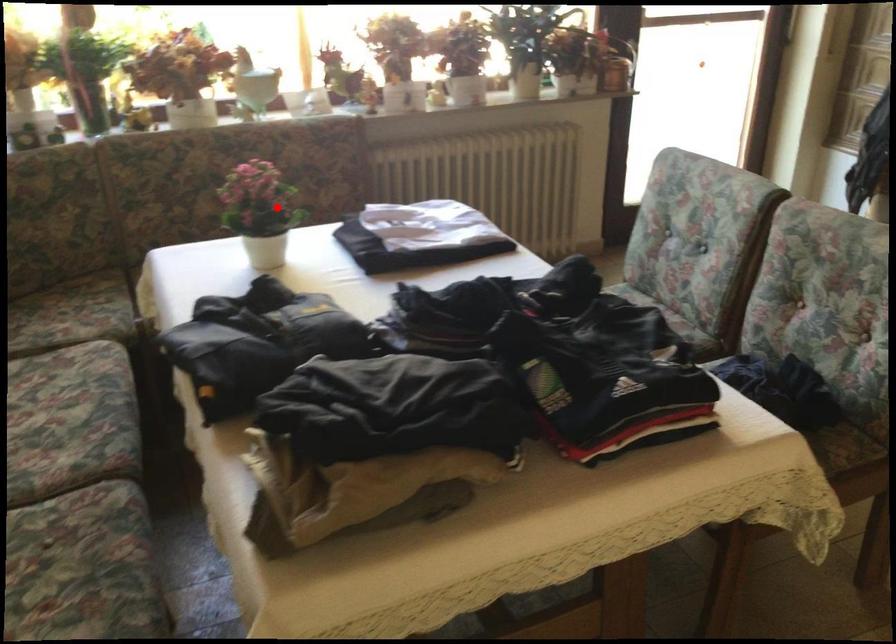
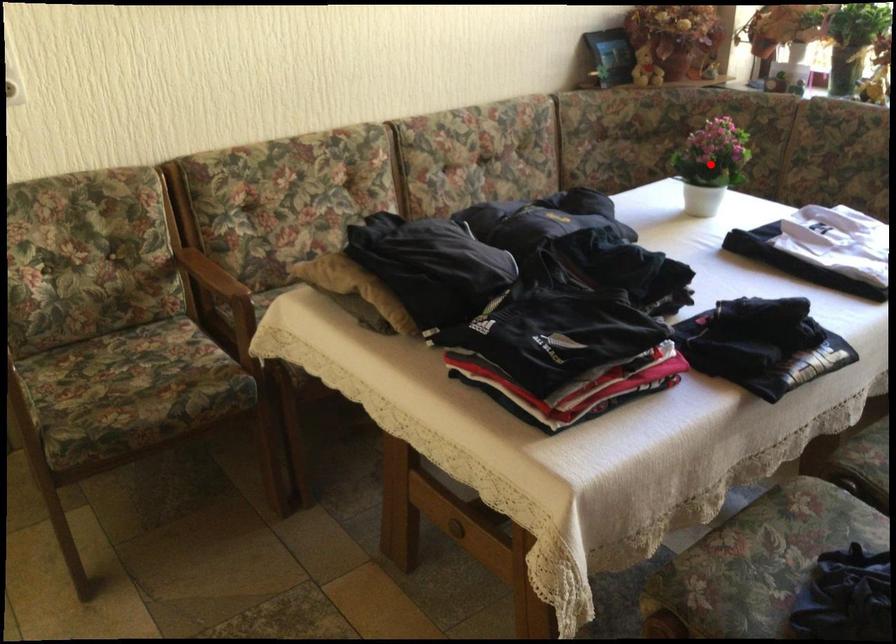
Looking at this image, I am providing you with two images of the same scene from different viewpoints. A red point is marked on the first image and another point is marked on the second image. Is the red point in image1 aligned with the point shown in image2?

Yes